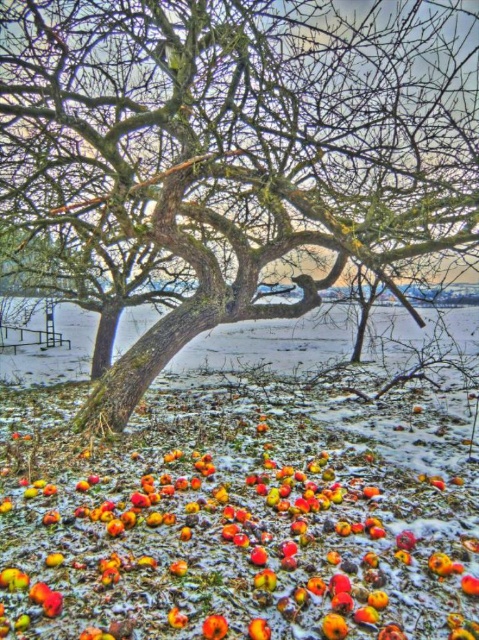
Based on the photo, you are an apple picker trying to collect apples under the tree. You see the rough bark tree at center and the shiny red apple at center. Which object is higher up in the scene?

The rough bark tree at center is located above the shiny red apple at center, so the rough bark tree at center is higher up in the scene.

You are a squirrel looking for food. You see the rough bark tree at center and the shiny red apple at center. Which one is larger in size?

The rough bark tree at center is bigger than the shiny red apple at center, so the rough bark tree at center is larger in size.